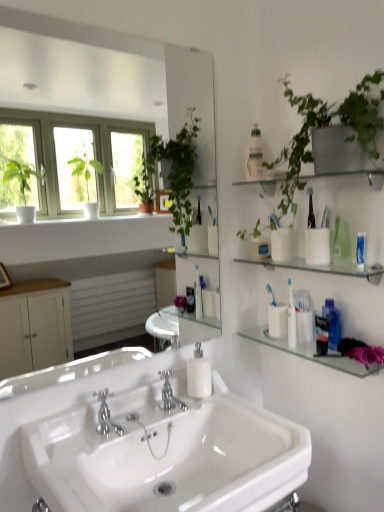
Question: Should I look upward or downward to see white matte cup at right, marked as the 2th toiletry in a top-to-bottom arrangement?

Choices:
 (A) up
 (B) down

Answer: (B)

Question: From the image's perspective, is clear glass shelf at upper right, which appears as the second shelf when viewed from the top, below white matte cup at right, acting as the 2th toiletry starting from the left?

Choices:
 (A) no
 (B) yes

Answer: (A)

Question: Is clear glass shelf at upper right, which appears as the second shelf when ordered from the bottom, next to white matte cup at right, marked as the 2th toiletry in a top-to-bottom arrangement?

Choices:
 (A) yes
 (B) no

Answer: (B)

Question: Is the position of clear glass shelf at upper right, which appears as the second shelf when ordered from the bottom, more distant than that of white matte cup at right, placed as the 1th toiletry when sorted from bottom to top?

Choices:
 (A) yes
 (B) no

Answer: (B)

Question: Could you tell me if clear glass shelf at upper right, which appears as the second shelf when viewed from the top, is facing white matte cup at right, marked as the 2th toiletry in a top-to-bottom arrangement?

Choices:
 (A) no
 (B) yes

Answer: (A)

Question: Considering the relative sizes of clear glass shelf at upper right, which appears as the second shelf when viewed from the top, and white matte cup at right, placed as the 1th toiletry when sorted from bottom to top, in the image provided, is clear glass shelf at upper right, which appears as the second shelf when viewed from the top, thinner than white matte cup at right, placed as the 1th toiletry when sorted from bottom to top,?

Choices:
 (A) yes
 (B) no

Answer: (B)

Question: Considering the relative sizes of clear glass shelf at upper right, which appears as the second shelf when ordered from the bottom, and white matte cup at right, acting as the 2th toiletry starting from the left, in the image provided, is clear glass shelf at upper right, which appears as the second shelf when ordered from the bottom, smaller than white matte cup at right, acting as the 2th toiletry starting from the left,?

Choices:
 (A) no
 (B) yes

Answer: (A)

Question: Considering the relative sizes of white glossy sink at center and white matte cup at right, placed as the 1th toiletry when sorted from bottom to top, in the image provided, is white glossy sink at center taller than white matte cup at right, placed as the 1th toiletry when sorted from bottom to top,?

Choices:
 (A) no
 (B) yes

Answer: (B)

Question: Could you tell me if white glossy sink at center is facing white matte cup at right, marked as the first toiletry in a right-to-left arrangement?

Choices:
 (A) no
 (B) yes

Answer: (A)

Question: Does white glossy sink at center touch white matte cup at right, placed as the 1th toiletry when sorted from bottom to top?

Choices:
 (A) no
 (B) yes

Answer: (A)

Question: Is white glossy sink at center facing away from white matte cup at right, marked as the first toiletry in a right-to-left arrangement?

Choices:
 (A) no
 (B) yes

Answer: (A)

Question: Does white glossy sink at center have a lesser width compared to white matte cup at right, acting as the 2th toiletry starting from the left?

Choices:
 (A) yes
 (B) no

Answer: (B)

Question: Is white glossy sink at center to the left of white matte cup at right, placed as the 1th toiletry when sorted from bottom to top, from the viewer's perspective?

Choices:
 (A) no
 (B) yes

Answer: (B)

Question: Is white matte cup at right, placed as the 1th toiletry when sorted from bottom to top, smaller than polished chrome faucet at center, which is the first tap in right-to-left order?

Choices:
 (A) yes
 (B) no

Answer: (A)